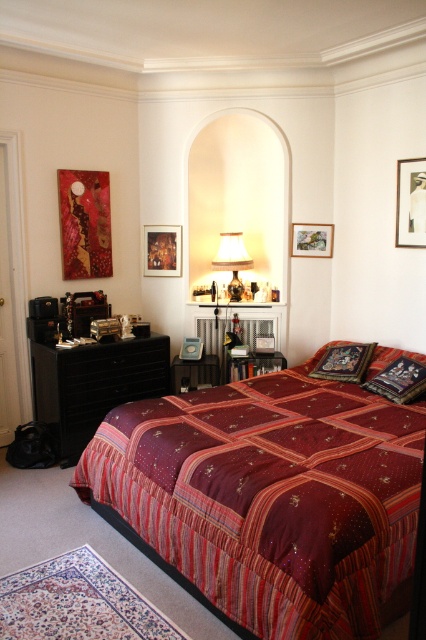
Is burgundy satin bed at center bigger than matte black picture frame at upper right?

Correct, burgundy satin bed at center is larger in size than matte black picture frame at upper right.

Find the location of a particular element. Image resolution: width=426 pixels, height=640 pixels. burgundy satin bed at center is located at coordinates (270, 499).

Which is behind, point (391, 552) or point (423, 170)?

Point (423, 170)

Identify the location of burgundy satin bed at center. (270, 499).

Which of these two, burgundy satin bed at center or wooden picture frame at center, stands shorter?

wooden picture frame at center

Find the location of a particular element. Image resolution: width=426 pixels, height=640 pixels. burgundy satin bed at center is located at coordinates (270, 499).

The image size is (426, 640). Identify the location of burgundy satin bed at center. (270, 499).

Can you confirm if matte black picture frame at upper right is bigger than wooden picture frame at center?

Yes, matte black picture frame at upper right is bigger than wooden picture frame at center.

Is matte black picture frame at upper right to the left of wooden picture frame at center from the viewer's perspective?

Incorrect, matte black picture frame at upper right is not on the left side of wooden picture frame at center.

Is point (416, 186) positioned after point (304, 225)?

No, it is not.

Where is `matte black picture frame at upper right`? matte black picture frame at upper right is located at coordinates (411, 202).